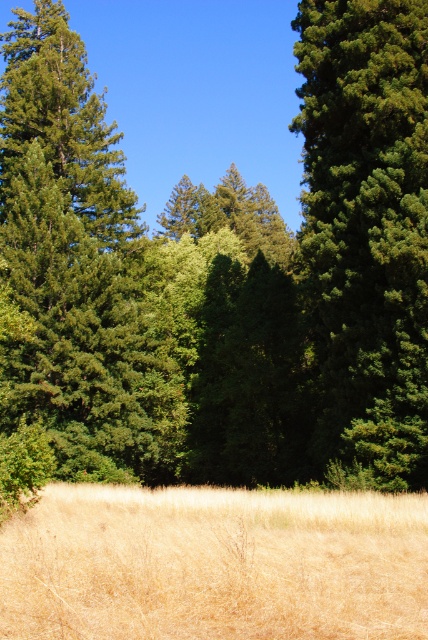
You are a hiker trying to cross this landscape. You notice the dry grass at center and the green matte tree at right. Which of these two objects would you say is larger in size?

The dry grass at center has a smaller size compared to green matte tree at right, so the green matte tree at right is larger in size.

You are a gardener planning to mow the dry grass at center and trim the green matte tree at right. Which task requires more horizontal space to perform the work?

The dry grass at center might require more horizontal space since it is wider than the green matte tree at right.